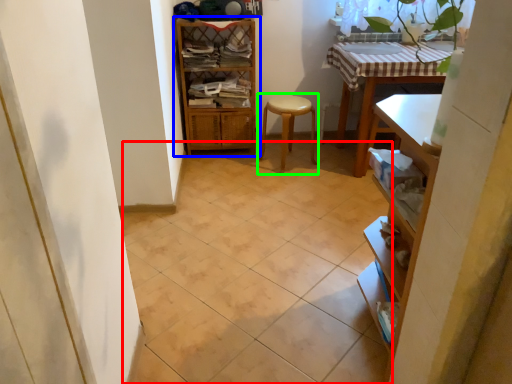
Question: Based on their relative distances, which object is farther from ceramic tile (highlighted by a red box)? Choose from shelf (highlighted by a blue box) and step stool (highlighted by a green box).

Choices:
 (A) shelf
 (B) step stool

Answer: (A)